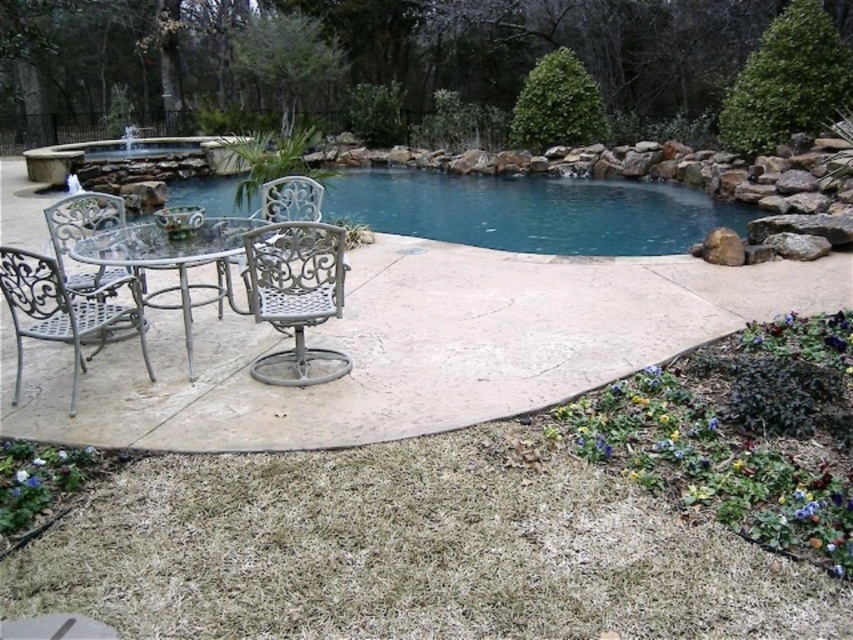
You are standing at the edge of the pool in the backyard and want to walk towards the patio area. Which point, point (140,307) or point (221,262), would you encounter first?

Point (140,307) is in front of point (221,262), so you would encounter point (140,307) first when walking towards the patio area.

You are planning to seat guests for a dinner party and need to choose between the metallic silver chair at center and the metallic silver chair at left. Which chair would you select if you prefer a more compact seating arrangement?

The metallic silver chair at center is smaller in size compared to the metallic silver chair at left, making it a better choice for a more compact seating arrangement.